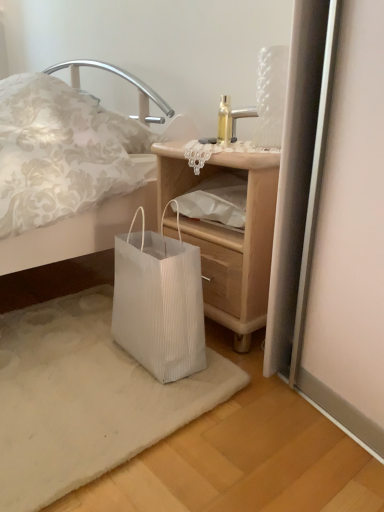
Question: Are wooden nightstand at lower center and white paper bag at lower left located far from each other?

Choices:
 (A) yes
 (B) no

Answer: (B)

Question: Is wooden nightstand at lower center looking in the opposite direction of white paper bag at lower left?

Choices:
 (A) yes
 (B) no

Answer: (A)

Question: From a real-world perspective, does wooden nightstand at lower center sit lower than white paper bag at lower left?

Choices:
 (A) no
 (B) yes

Answer: (A)

Question: Is wooden nightstand at lower center bigger than white paper bag at lower left?

Choices:
 (A) yes
 (B) no

Answer: (A)

Question: Does wooden nightstand at lower center have a greater height compared to white paper bag at lower left?

Choices:
 (A) no
 (B) yes

Answer: (B)

Question: Could you tell me if wooden nightstand at lower center is facing white paper bag at lower left?

Choices:
 (A) yes
 (B) no

Answer: (A)

Question: Is white pleated paper bag at lower left not near wooden nightstand at lower center?

Choices:
 (A) no
 (B) yes

Answer: (A)

Question: Is white pleated paper bag at lower left bigger than wooden nightstand at lower center?

Choices:
 (A) yes
 (B) no

Answer: (B)

Question: From a real-world perspective, is white pleated paper bag at lower left positioned under wooden nightstand at lower center based on gravity?

Choices:
 (A) no
 (B) yes

Answer: (B)

Question: Does white pleated paper bag at lower left have a smaller size compared to wooden nightstand at lower center?

Choices:
 (A) yes
 (B) no

Answer: (A)

Question: From the image's perspective, does white pleated paper bag at lower left appear higher than wooden nightstand at lower center?

Choices:
 (A) yes
 (B) no

Answer: (B)

Question: Is white pleated paper bag at lower left surrounding wooden nightstand at lower center?

Choices:
 (A) no
 (B) yes

Answer: (A)

Question: Is white pleated paper bag at lower left turned away from white paper bag at lower left?

Choices:
 (A) no
 (B) yes

Answer: (A)